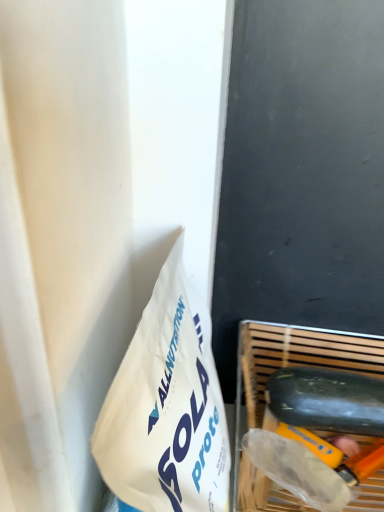
Question: Would you say smooth black cucumber at lower right is inside or outside wooden slatted basket at lower right?

Choices:
 (A) inside
 (B) outside

Answer: (A)

Question: From the image's perspective, is smooth black cucumber at lower right above or below wooden slatted basket at lower right?

Choices:
 (A) below
 (B) above

Answer: (B)

Question: Based on their positions, is smooth black cucumber at lower right located to the left or right of wooden slatted basket at lower right?

Choices:
 (A) right
 (B) left

Answer: (A)

Question: Which is correct: wooden slatted basket at lower right is inside smooth black cucumber at lower right, or outside of it?

Choices:
 (A) outside
 (B) inside

Answer: (A)

Question: In terms of width, does wooden slatted basket at lower right look wider or thinner when compared to smooth black cucumber at lower right?

Choices:
 (A) wide
 (B) thin

Answer: (A)

Question: Based on their positions, is wooden slatted basket at lower right located to the left or right of smooth black cucumber at lower right?

Choices:
 (A) right
 (B) left

Answer: (B)

Question: From the image's perspective, is wooden slatted basket at lower right located above or below smooth black cucumber at lower right?

Choices:
 (A) above
 (B) below

Answer: (B)